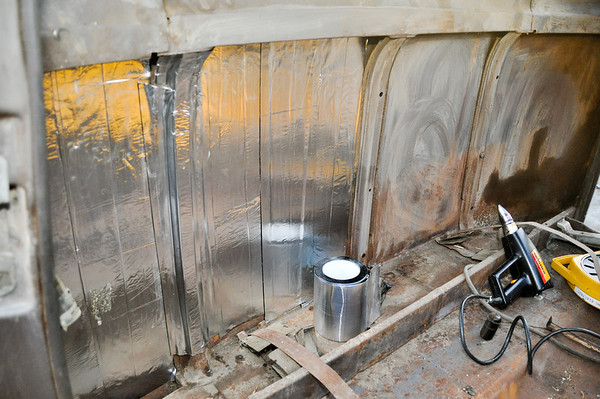
The height and width of the screenshot is (399, 600). Identify the location of black cord. (463, 333).